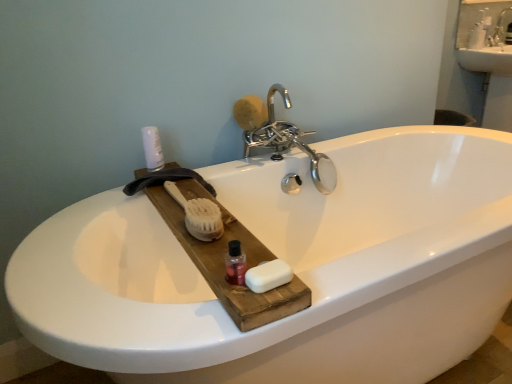
Image resolution: width=512 pixels, height=384 pixels. In order to click on vacant area that lies between white natural wood brush at center and translucent plastic bottle at center in this screenshot , I will do `click(224, 251)`.